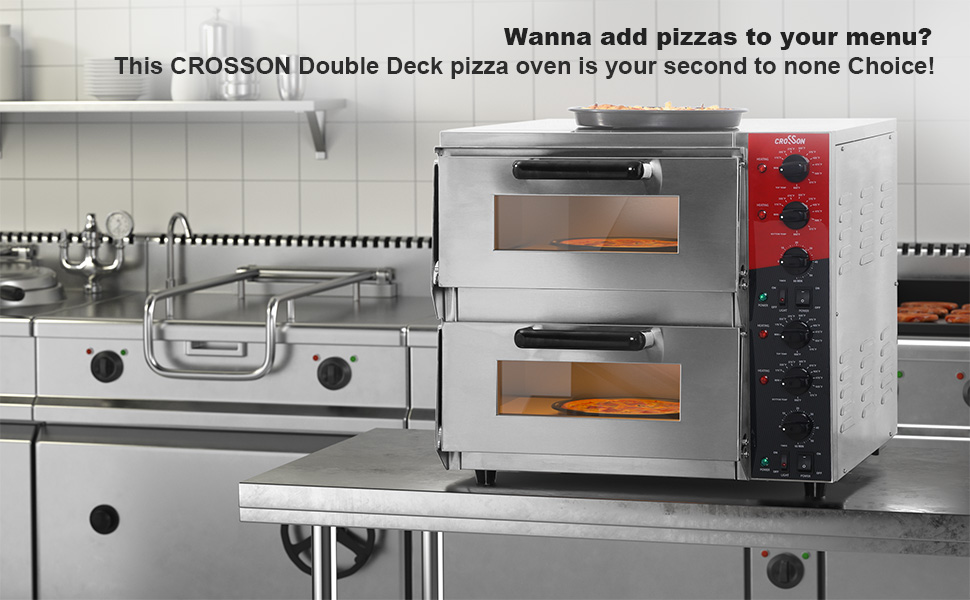
You are a GUI agent. You are given a task and a screenshot of the screen. Output one action in this format:
    pyautogui.click(x=<x>, y=<y>)
    Task: Click on the bowl
    
    Given the screenshot: What is the action you would take?
    pyautogui.click(x=674, y=125)